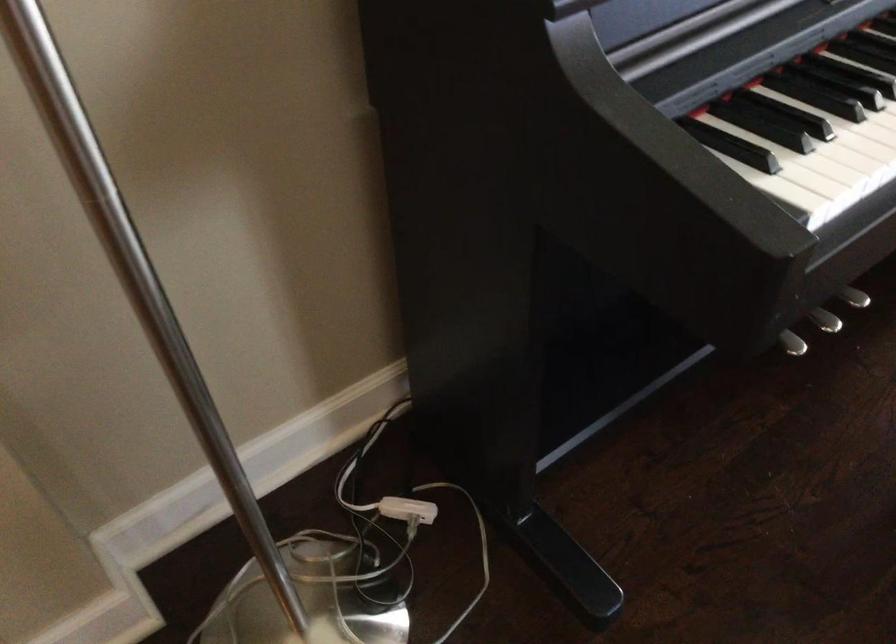
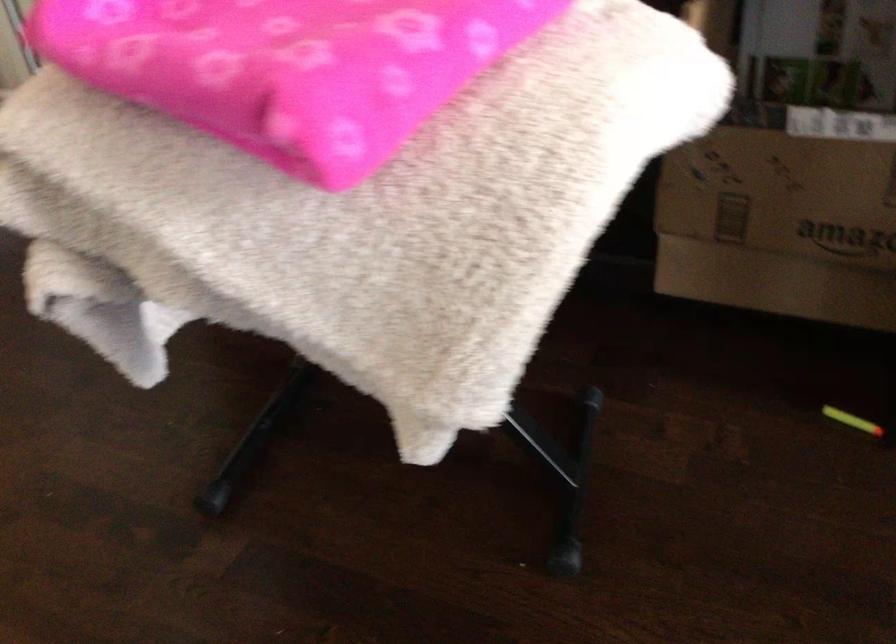
Question: I am providing you with two images of the same scene from different viewpoints. After the viewpoint changes to image2, which objects are now occluded?

Choices:
 (A) white power strip
 (B) white surfboard
 (C) cardboard amazon box
 (D) pink folded blanket

Answer: (A)